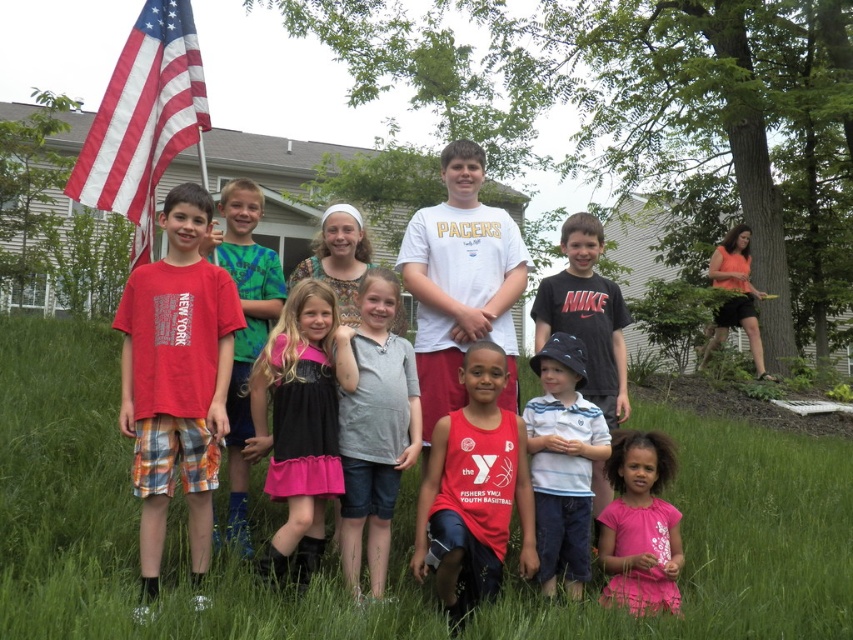
You are a photographer taking a picture of the group of children. You notice the pink satin dress at center and the gray cotton shirt at center. Which clothing item is positioned higher in the image?

The pink satin dress at center is located above the gray cotton shirt at center, so it is positioned higher in the image.

You are a photographer setting up for a group photo. You need to ensure that all children are visible in the frame. The pink satin dress at center and the gray cotton shirt at center are both in the center. Which clothing item requires more space to avoid being cut off?

The pink satin dress at center requires more space because its width is larger than the gray cotton shirt at center, so it is more likely to be cut off if not positioned properly.

You are a photographer taking a picture of the children. You notice two red shirts at the center of the group. Which one is closer to you, the photographer, between the red jersey at center and the matte red shirt at center?

The red jersey at center is closer to the viewer than the matte red shirt at center.